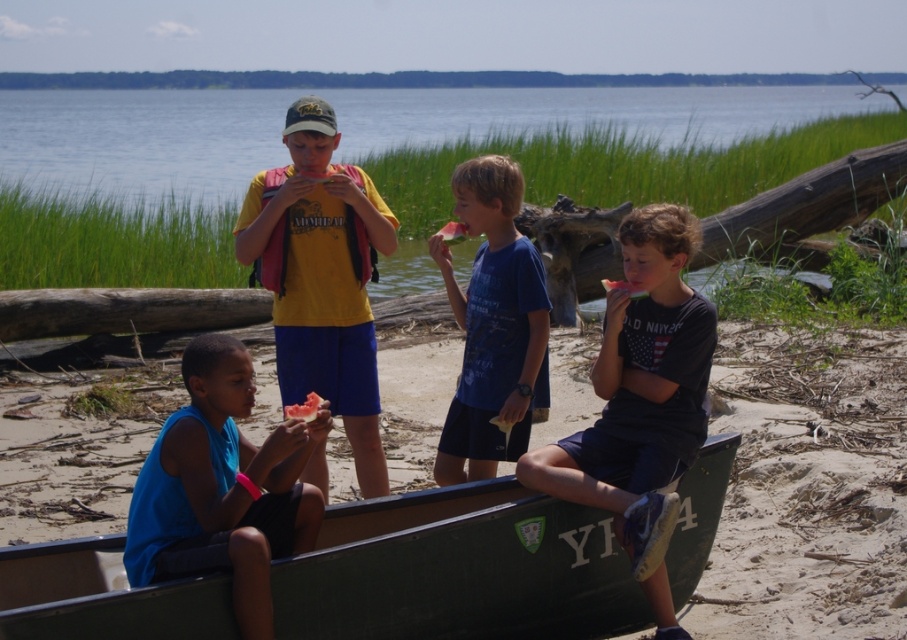
Is point (353, 637) positioned before point (276, 200)?

Yes.

Which is above, green matte canoe at lower center or yellow matte t-shirt at center?

yellow matte t-shirt at center is above.

Which is in front, point (608, 534) or point (371, 182)?

Point (608, 534) is more forward.

Find the location of a particular element. This screenshot has width=907, height=640. green matte canoe at lower center is located at coordinates (459, 570).

Who is positioned more to the right, dark blue shorts at center or blue cotton shirt at center?

dark blue shorts at center is more to the right.

The width and height of the screenshot is (907, 640). What do you see at coordinates (641, 401) in the screenshot?
I see `dark blue shorts at center` at bounding box center [641, 401].

What do you see at coordinates (641, 401) in the screenshot?
I see `dark blue shorts at center` at bounding box center [641, 401].

Locate an element on the screen. The height and width of the screenshot is (640, 907). dark blue shorts at center is located at coordinates (641, 401).

Does green matte canoe at lower center have a lesser height compared to blue fabric shirt at center?

Yes, green matte canoe at lower center is shorter than blue fabric shirt at center.

The width and height of the screenshot is (907, 640). I want to click on green matte canoe at lower center, so click(459, 570).

Image resolution: width=907 pixels, height=640 pixels. In order to click on green matte canoe at lower center in this screenshot , I will do `click(459, 570)`.